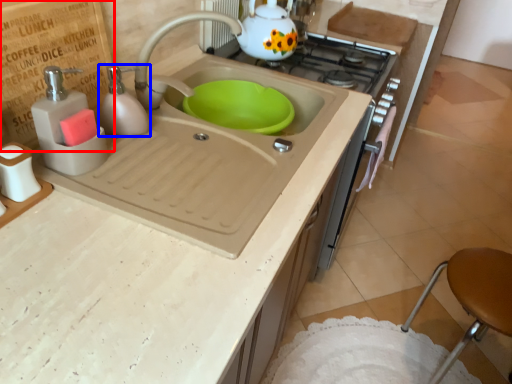
Question: Which point is further to the camera, plywood (highlighted by a red box) or soap dispenser (highlighted by a blue box)?

Choices:
 (A) plywood
 (B) soap dispenser

Answer: (B)